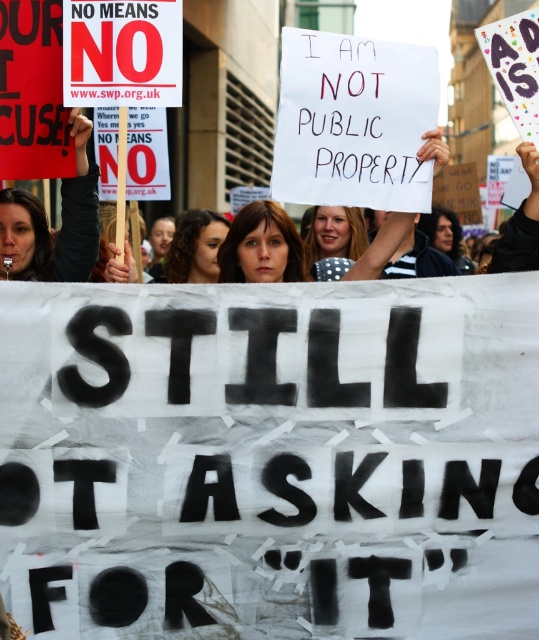
Between white paper at center and matte brown hair at center, which one has less height?

matte brown hair at center

Who is taller, white paper at center or matte brown hair at center?

white paper at center

Who is more forward, (384, 83) or (262, 204)?

Point (384, 83) is in front.

Image resolution: width=539 pixels, height=640 pixels. What are the coordinates of `white paper at center` in the screenshot? It's located at (354, 122).

Does point (286, 268) lie in front of point (350, 227)?

Yes, point (286, 268) is closer to viewer.

Between matte brown hair at center and blonde hair at center, which one is positioned lower?

Positioned lower is matte brown hair at center.

Between point (231, 253) and point (344, 236), which one is positioned in front?

Point (231, 253)

Locate an element on the screen. The width and height of the screenshot is (539, 640). matte brown hair at center is located at coordinates (260, 246).

Based on the photo, can you confirm if matte brown hair at center is positioned above curly brown hair at center?

No.

Measure the distance between matte brown hair at center and camera.

22.13 feet

Is point (265, 211) positioned before point (197, 257)?

Yes, point (265, 211) is in front of point (197, 257).

Where is `matte brown hair at center`? The image size is (539, 640). matte brown hair at center is located at coordinates (260, 246).